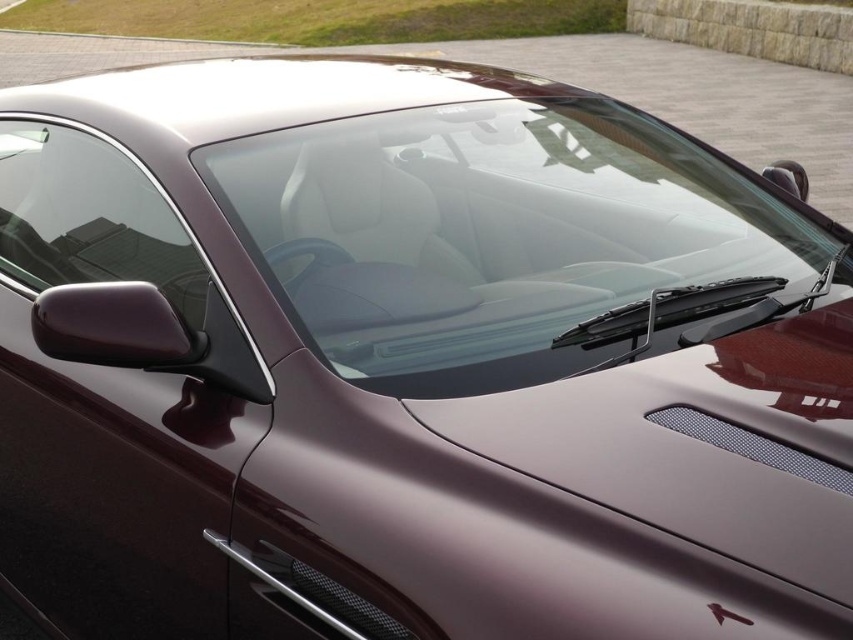
You are a delivery person trying to place a rectangular package that is 27 inches long on the car hood. The package must be placed between the transparent glass windshield at center and the transparent glass windshield at upper left. Can the package fit horizontally between these two points?

The distance between the transparent glass windshield at center and the transparent glass windshield at upper left is 26.85 inches. Since the package is 27 inches long, it cannot fit horizontally between these two points as it exceeds the available space by 0.15 inches.

You are a car designer looking at the front section of a maroon car. You notice two transparent glass windshields labeled as the transparent glass windshield at center and the transparent glass windshield at upper left. Which windshield is located to the right of the other?

The transparent glass windshield at center is positioned on the right side of the transparent glass windshield at upper left.

Consider the image. You are a driver looking at the front of the car. Where exactly is the transparent glass windshield at center located in terms of its 2D coordinates?

The transparent glass windshield at center is located at the 2D coordinates of point [492,232].